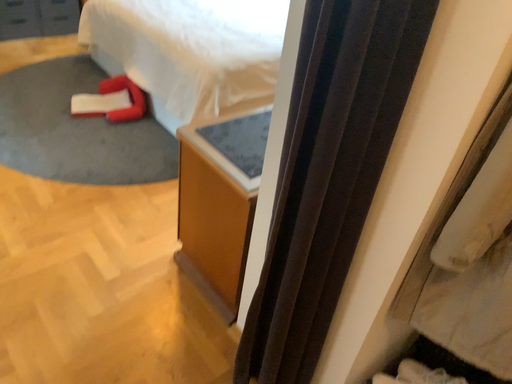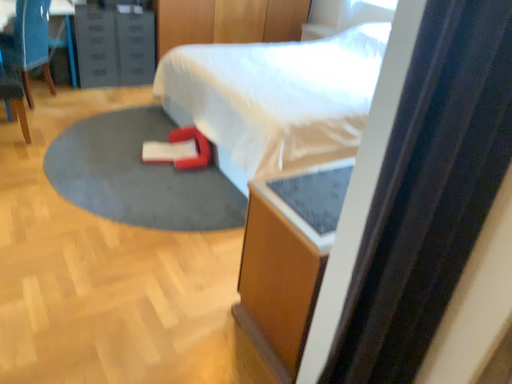
Question: How did the camera likely rotate when shooting the video?

Choices:
 (A) rotated upward
 (B) rotated downward

Answer: (A)